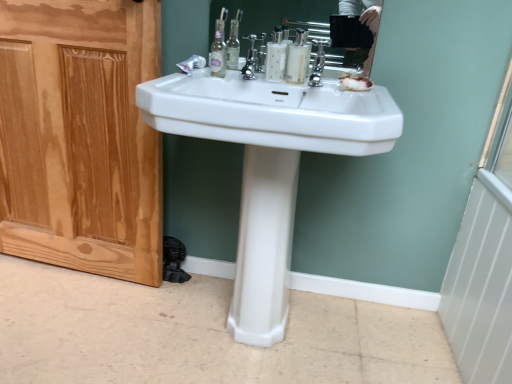
Find the location of a particular element. This screenshot has width=512, height=384. free space to the left of white glossy pedestal at center is located at coordinates (200, 317).